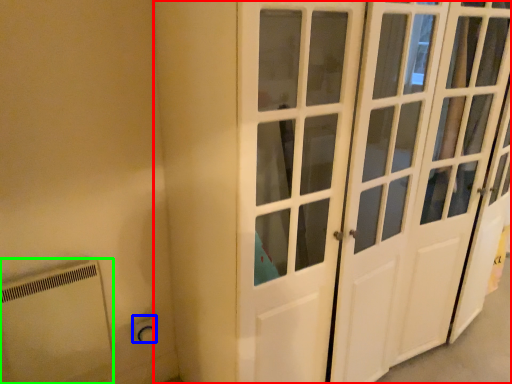
Question: Which object is positioned closest to door (highlighted by a red box)? Select from electric outlet (highlighted by a blue box) and appliance (highlighted by a green box).

Choices:
 (A) electric outlet
 (B) appliance

Answer: (B)